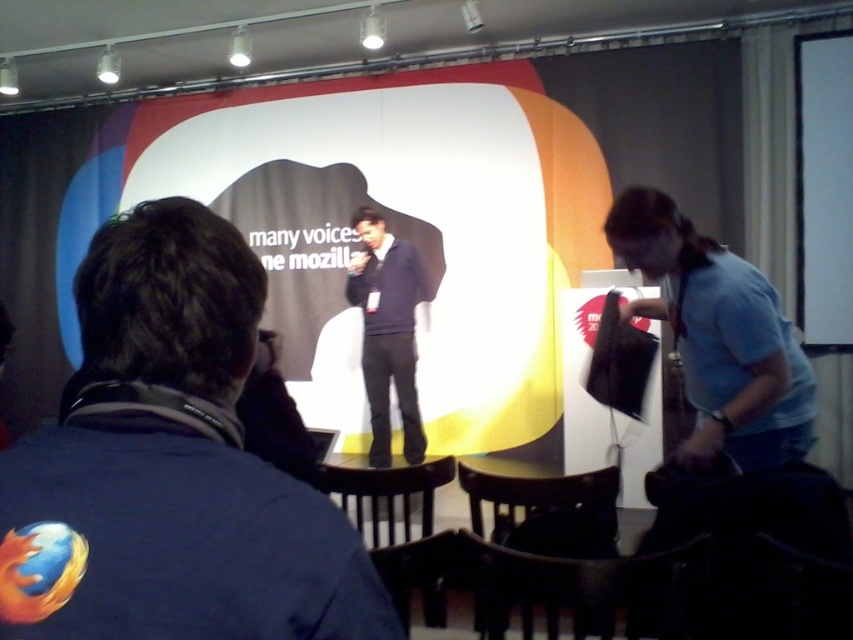
You are attending the Mozilla event and notice two attendees wearing blue denim jacket at center and dark blue sweater at center. Which clothing item is shorter in height?

The blue denim jacket at center is shorter than the dark blue sweater at center.

You are at the Mozilla event and need to locate two specific items in the image. The first is the blue denim jacket at center, and the second is the light blue fabric shirt at right. From the perspective of someone facing the image, which item is positioned to the left?

The blue denim jacket at center is positioned to the left of the light blue fabric shirt at right.

You are standing at the point marked as point (163, 624). You want to move towards the podium on stage. Is there enough space between you and the podium to walk comfortably? The average comfortable walking space is 24 inches.

The distance between you and the podium is 18.40 inches, which is less than the required 24 inches for comfortable walking space. Therefore, there is not enough space to walk comfortably towards the podium.